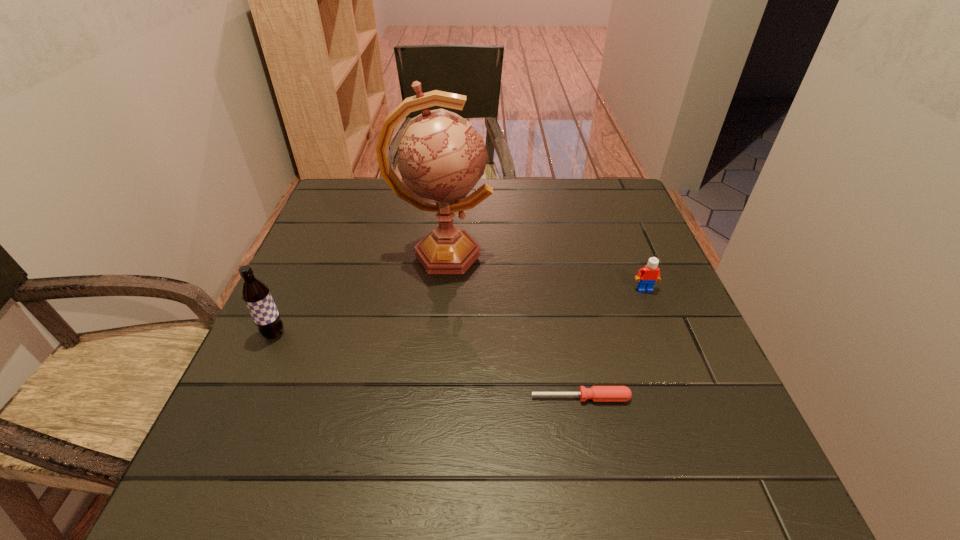
The height and width of the screenshot is (540, 960). Find the location of `free space between the second nearest object and the third object from left to right`. free space between the second nearest object and the third object from left to right is located at coordinates (427, 366).

The width and height of the screenshot is (960, 540). I want to click on vacant space in between the screwdriver and the rightmost object, so click(612, 343).

The height and width of the screenshot is (540, 960). I want to click on vacant area that lies between the third shortest object and the second shortest object, so point(459,311).

I want to click on vacant area between the shortest object and the root beer, so click(427, 366).

Where is `vacant space that's between the farthest object and the leftmost object`? vacant space that's between the farthest object and the leftmost object is located at coordinates (358, 294).

The height and width of the screenshot is (540, 960). Find the location of `empty location between the rightmost object and the screwdriver`. empty location between the rightmost object and the screwdriver is located at coordinates (612, 343).

Locate an element on the screen. Image resolution: width=960 pixels, height=540 pixels. vacant area between the leftmost object and the third nearest object is located at coordinates (459, 311).

This screenshot has width=960, height=540. I want to click on free point between the third nearest object and the shortest object, so click(612, 343).

You are a GUI agent. You are given a task and a screenshot of the screen. Output one action in this format:
    pyautogui.click(x=<x>, y=<y>)
    Task: Click on the vacant space that's between the Lego and the second object from right to left
    The width and height of the screenshot is (960, 540).
    Given the screenshot: What is the action you would take?
    pyautogui.click(x=612, y=343)

You are a GUI agent. You are given a task and a screenshot of the screen. Output one action in this format:
    pyautogui.click(x=<x>, y=<y>)
    Task: Click on the blank region between the leftmost object and the second object from right to left
    The width and height of the screenshot is (960, 540).
    Given the screenshot: What is the action you would take?
    pyautogui.click(x=427, y=366)